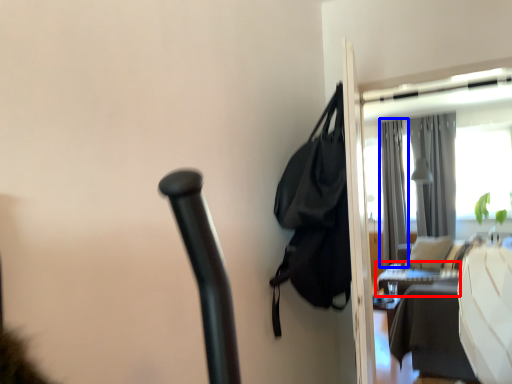
Question: Which object is closer to the camera taking this photo, table (highlighted by a red box) or curtain (highlighted by a blue box)?

Choices:
 (A) table
 (B) curtain

Answer: (A)